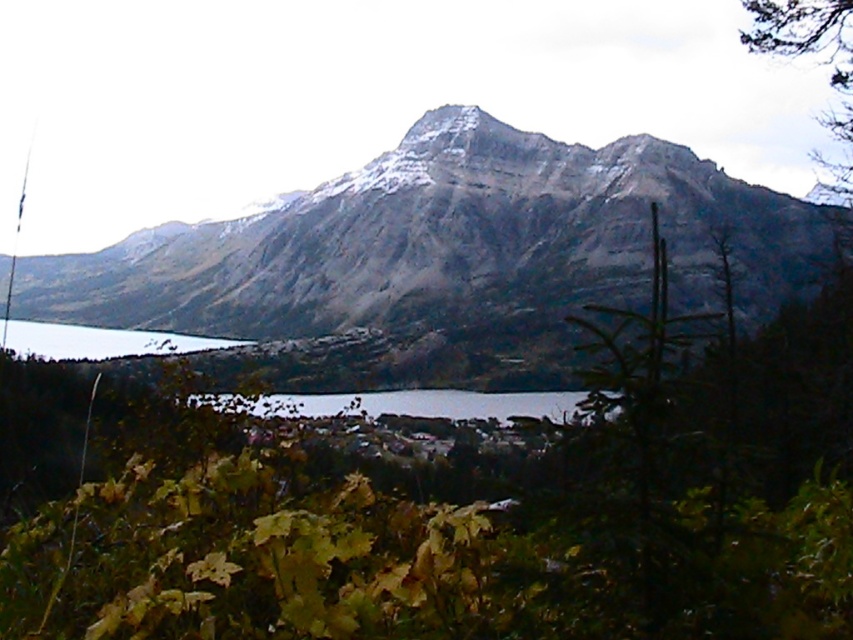
Question: In this image, where is clear water at center located relative to clear water at lake left?

Choices:
 (A) above
 (B) below

Answer: (B)

Question: Estimate the real-world distances between objects in this image. Which object is farther from the brown textured tree at upper right?

Choices:
 (A) clear water at center
 (B) clear water at lake left
 (C) snowy rock mountain at center

Answer: (B)

Question: Which of these objects is positioned closest to the snowy rock mountain at center?

Choices:
 (A) clear water at lake left
 (B) brown textured tree at upper right
 (C) clear water at center

Answer: (A)

Question: Does snowy rock mountain at center appear on the right side of clear water at center?

Choices:
 (A) yes
 (B) no

Answer: (B)

Question: Is brown textured tree at upper right to the right of clear water at lake left from the viewer's perspective?

Choices:
 (A) yes
 (B) no

Answer: (A)

Question: Which point is closer to the camera?

Choices:
 (A) clear water at lake left
 (B) brown textured tree at upper right
 (C) clear water at center
 (D) snowy rock mountain at center

Answer: (C)